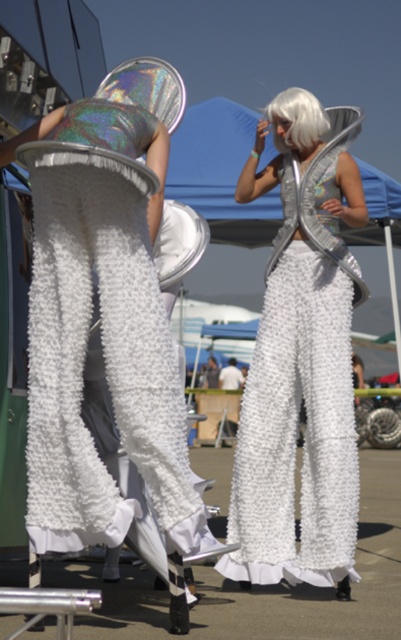
Does metallic silver pole at center have a greater height compared to white fluffy wig at upper center?

In fact, metallic silver pole at center may be shorter than white fluffy wig at upper center.

Does metallic silver pole at center have a greater width compared to white fluffy wig at upper center?

Indeed, metallic silver pole at center has a greater width compared to white fluffy wig at upper center.

Find the location of a particular element. The height and width of the screenshot is (640, 401). metallic silver pole at center is located at coordinates (48, 605).

Can you confirm if white fluffy pants at center is positioned above shiny metallic vest at center?

Yes, white fluffy pants at center is above shiny metallic vest at center.

Is point (99, 182) positioned after point (255, 164)?

No, it is not.

Find the location of `white fluffy pants at center`. white fluffy pants at center is located at coordinates (105, 324).

Does white fluffy pants at center have a lesser height compared to metallic silver pole at center?

In fact, white fluffy pants at center may be taller than metallic silver pole at center.

Is white fluffy pants at center taller than metallic silver pole at center?

Yes, white fluffy pants at center is taller than metallic silver pole at center.

Which is in front, point (44, 515) or point (22, 593)?

Point (22, 593)

You are a GUI agent. You are given a task and a screenshot of the screen. Output one action in this format:
    pyautogui.click(x=<x>, y=<y>)
    Task: Click on the white fluffy pants at center
    The image size is (401, 640).
    Given the screenshot: What is the action you would take?
    pyautogui.click(x=105, y=324)